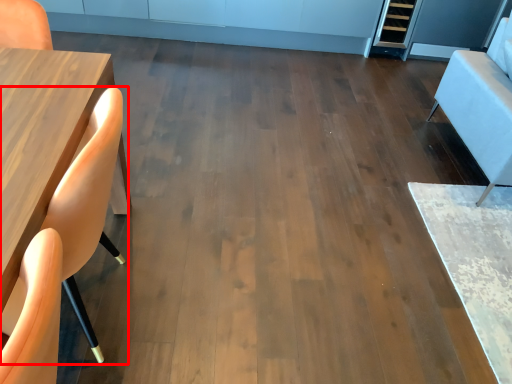
Question: From the image's perspective, where is chair (annotated by the red box) located relative to armchair?

Choices:
 (A) above
 (B) below

Answer: (B)